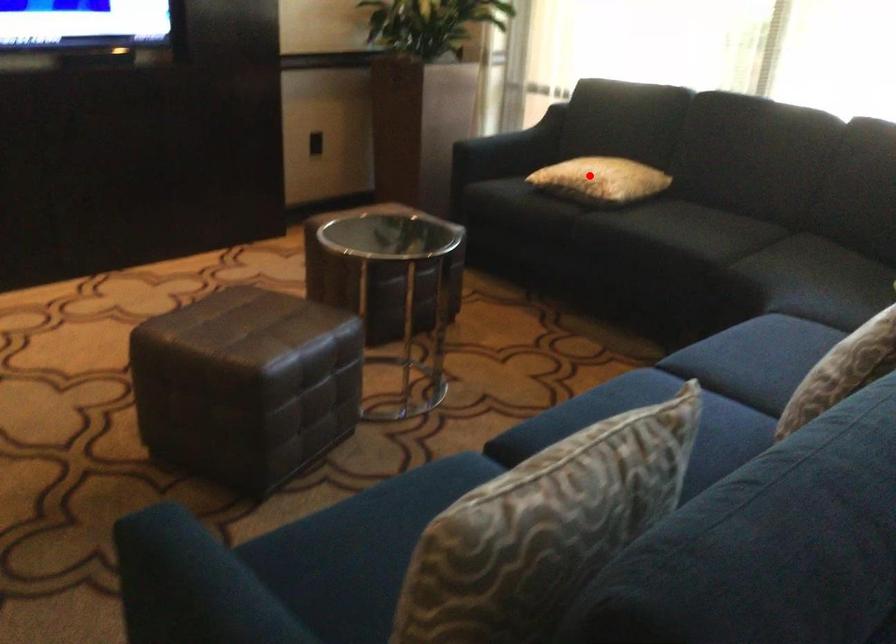
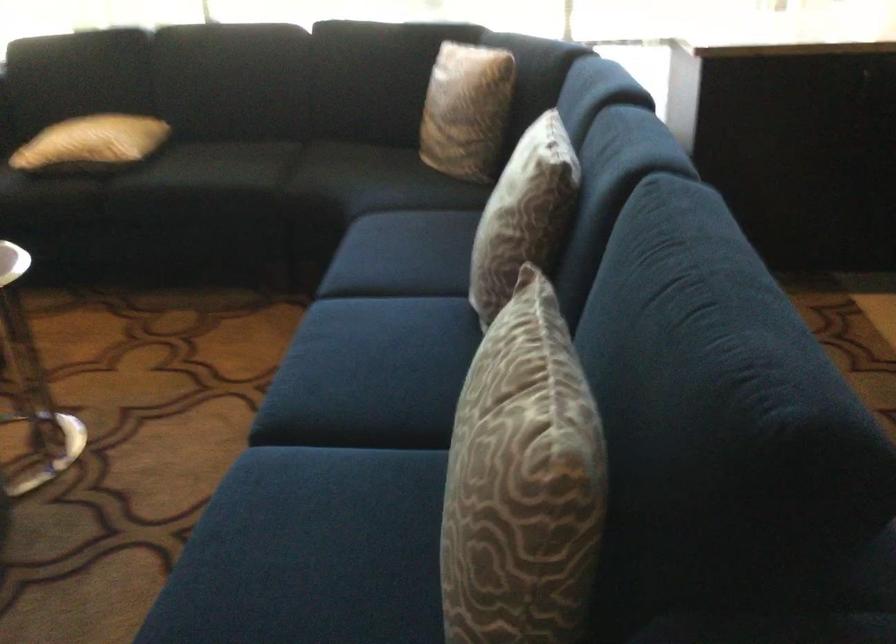
Question: I am providing you with two images of the same scene from different viewpoints. In image1, a red point is highlighted. Considering the same 3D point in image2, which of the following is correct?

Choices:
 (A) It is closer
 (B) It is farther

Answer: (A)